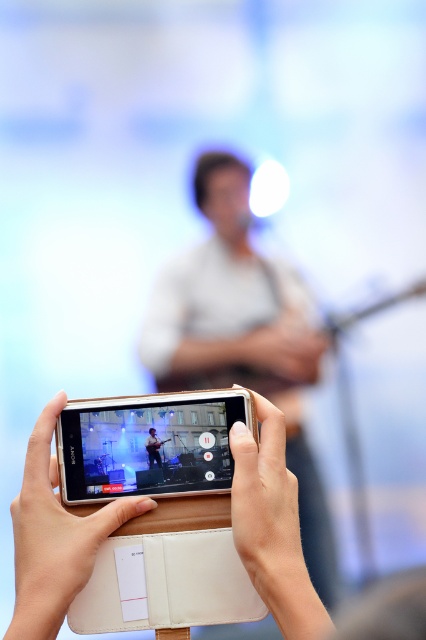
From the picture: You are holding a smartphone with a screen that shows a live performance. There is a point at coordinates (221, 396) on the screen. If your eyes are 24 inches away from the phone, can you see the point clearly?

The point at coordinates (221, 396) and the viewer are 24.68 inches apart. Since your eyes are 24 inches away from the phone, you are slightly closer than the required distance, so you might not see the point clearly.

What are the coordinates of the white matte guitar at center?

The white matte guitar at center is located at coordinates point (244, 337).